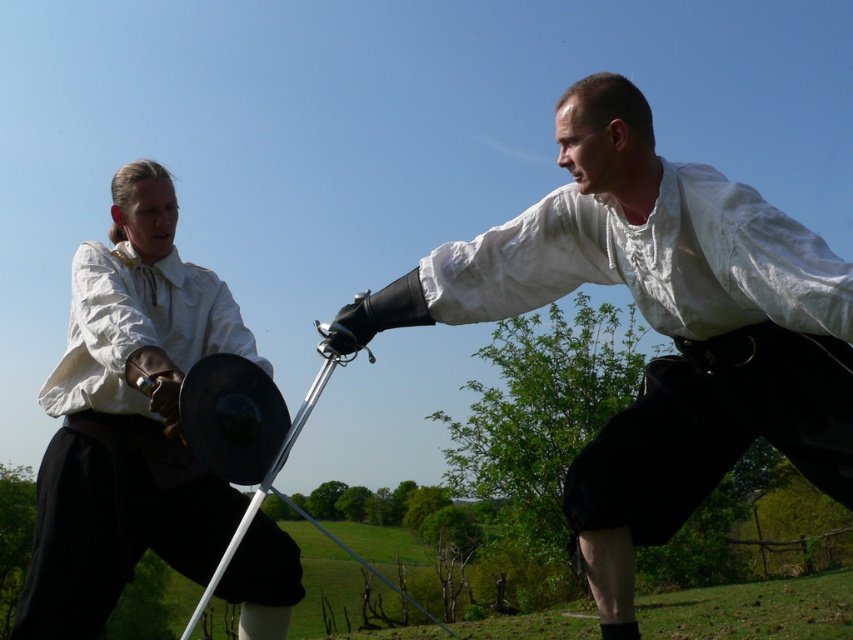
Question: Which of the following is the farthest from the observer?

Choices:
 (A) pos(173,368)
 (B) pos(358,346)
 (C) pos(703,220)

Answer: (B)

Question: Observing the image, what is the correct spatial positioning of white matte shirt at upper right in reference to matte white shirt at center?

Choices:
 (A) right
 (B) left

Answer: (A)

Question: Does white matte shirt at upper right appear on the right side of matte white shirt at center?

Choices:
 (A) yes
 (B) no

Answer: (A)

Question: Is white matte shirt at upper right to the right of black metal pole at center from the viewer's perspective?

Choices:
 (A) yes
 (B) no

Answer: (A)

Question: Which point appears farthest from the camera in this image?

Choices:
 (A) (225, 532)
 (B) (469, 252)

Answer: (A)

Question: Among these points, which one is farthest from the camera?

Choices:
 (A) (189, 413)
 (B) (757, 252)
 (C) (206, 330)

Answer: (C)